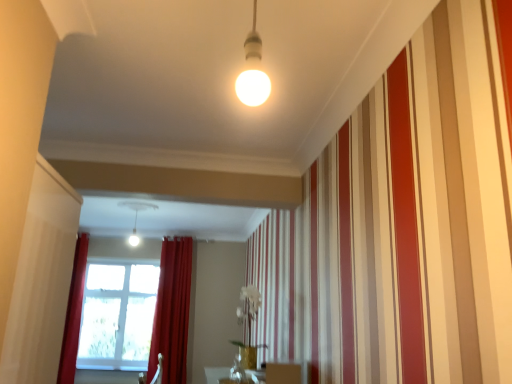
Question: Should I look upward or downward to see velvet red curtain at center, placed as the first curtain when sorted from right to left?

Choices:
 (A) down
 (B) up

Answer: (A)

Question: Could matte white light fixture at center be considered to be inside velvet red curtain at left, the first curtain when ordered from left to right?

Choices:
 (A) no
 (B) yes

Answer: (A)

Question: Can you confirm if velvet red curtain at left, the first curtain when ordered from left to right, is smaller than matte white light fixture at center?

Choices:
 (A) no
 (B) yes

Answer: (B)

Question: From the image's perspective, is velvet red curtain at left, positioned as the second curtain in right-to-left order, on top of matte white light fixture at center?

Choices:
 (A) yes
 (B) no

Answer: (B)

Question: Does velvet red curtain at left, positioned as the second curtain in right-to-left order, have a lesser width compared to matte white light fixture at center?

Choices:
 (A) yes
 (B) no

Answer: (A)

Question: Is velvet red curtain at left, positioned as the second curtain in right-to-left order, facing away from matte white light fixture at center?

Choices:
 (A) yes
 (B) no

Answer: (B)

Question: Is velvet red curtain at left, the first curtain when ordered from left to right, beside matte white light fixture at center?

Choices:
 (A) no
 (B) yes

Answer: (A)

Question: Are transparent glass window screen at lower left and matte gold vase at center beside each other?

Choices:
 (A) yes
 (B) no

Answer: (B)

Question: Is transparent glass window screen at lower left aimed at matte gold vase at center?

Choices:
 (A) no
 (B) yes

Answer: (A)

Question: Does transparent glass window screen at lower left have a greater width compared to matte gold vase at center?

Choices:
 (A) yes
 (B) no

Answer: (B)

Question: Is transparent glass window screen at lower left to the left of matte gold vase at center from the viewer's perspective?

Choices:
 (A) yes
 (B) no

Answer: (A)

Question: Does transparent glass window screen at lower left come in front of matte gold vase at center?

Choices:
 (A) no
 (B) yes

Answer: (A)

Question: Would you consider transparent glass window screen at lower left to be distant from matte gold vase at center?

Choices:
 (A) yes
 (B) no

Answer: (A)

Question: Can you confirm if matte gold vase at center is thinner than velvet red curtain at center, placed as the first curtain when sorted from right to left?

Choices:
 (A) yes
 (B) no

Answer: (A)